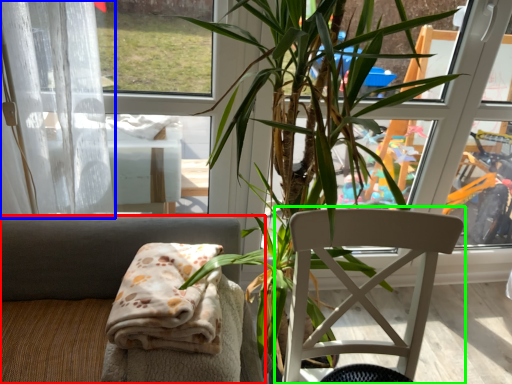
Question: Which is nearer to the chair (highlighted by a red box)? curtain (highlighted by a blue box) or chair (highlighted by a green box).

Choices:
 (A) curtain
 (B) chair

Answer: (A)